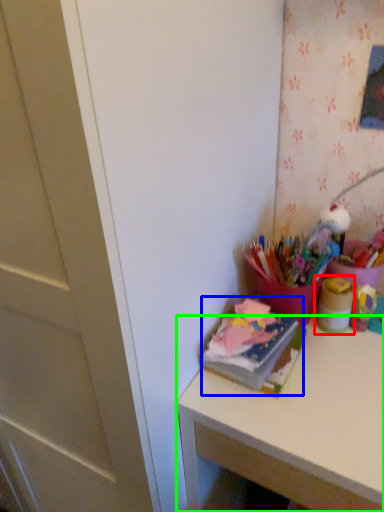
Question: Which object is positioned farthest from stationery (highlighted by a red box)? Select from book (highlighted by a blue box) and desk (highlighted by a green box).

Choices:
 (A) book
 (B) desk

Answer: (B)